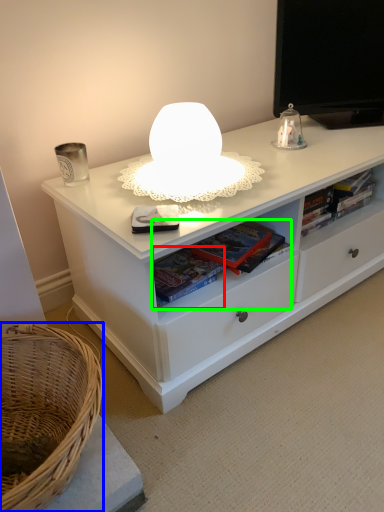
Question: Based on their relative distances, which object is farther from book (highlighted by a red box)? Choose from basket (highlighted by a blue box) and book (highlighted by a green box).

Choices:
 (A) basket
 (B) book

Answer: (A)